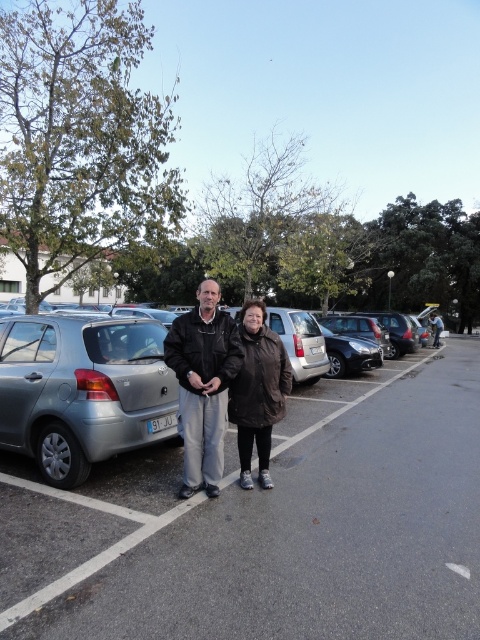
From the picture: You are a delivery person who needs to park your van between the two cars in the parking lot. The van is 2 meters wide. Can you fit your van between the silver metallic car at center and the satin silver hatchback at left?

The silver metallic car at center is wider than the satin silver hatchback at left. However, the exact distance between them isn not provided, so it is impossible to determine if the van will fit.

You are a photographer trying to capture a photo of the two people in the parking lot. You want to ensure that both the silver metallic hatchback at center and the satin silver hatchback at left are visible in the background. Based on their positions, can you tell which hatchback is closer to the camera?

Result: The silver metallic hatchback at center is closer to the camera than the satin silver hatchback at left, which is positioned behind it.

You are a delivery person who needs to park your van between the silver metallic hatchback at center and the satin silver hatchback at left. Your van is 10 feet long. Can you fit your van between them without overlapping either car?

The silver metallic hatchback at center and satin silver hatchback at left are 9.21 feet apart. Since your van is 10 feet long, it cannot fit between them without overlapping either car because the distance is shorter than the van.